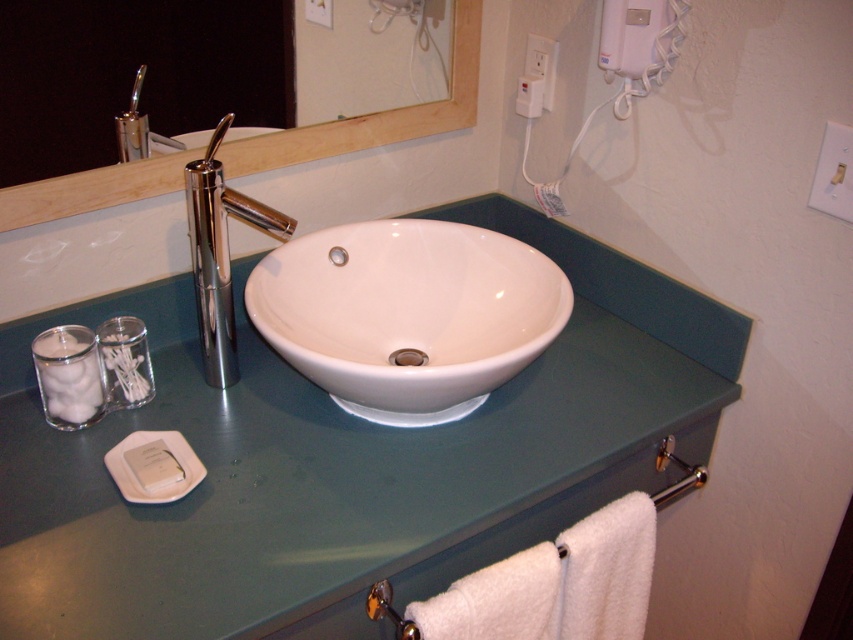
You are a person with a 12 inch long ruler. You want to measure the distance between the white glossy sink at center and the white matte soap at lower left. Can you reach the entire distance with your ruler?

The distance between the white glossy sink at center and the white matte soap at lower left is 14.31 inches. Since your ruler is only 12 inches long, you cannot fully measure the entire distance between them.

You are standing in front of the bathroom sink area. You need to reach a point located at coordinates point (114, 180). If your arm can extend 2 feet, can you reach that point?

The point (114, 180) is 3.42 feet away from you, which is farther than your arm can reach. You cannot reach it with your arm extended 2 feet.